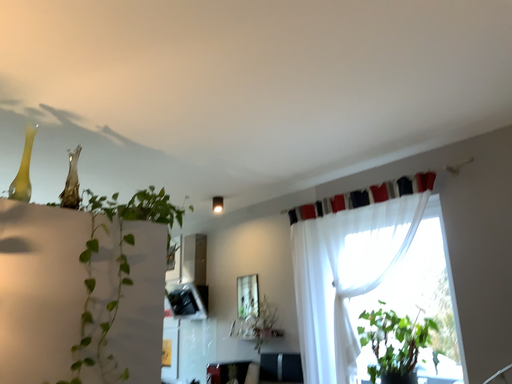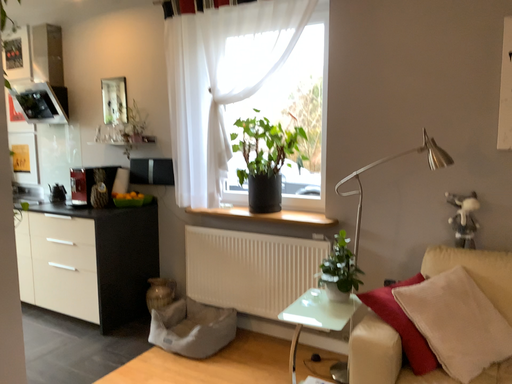
Question: How did the camera likely rotate when shooting the video?

Choices:
 (A) rotated upward
 (B) rotated downward

Answer: (B)